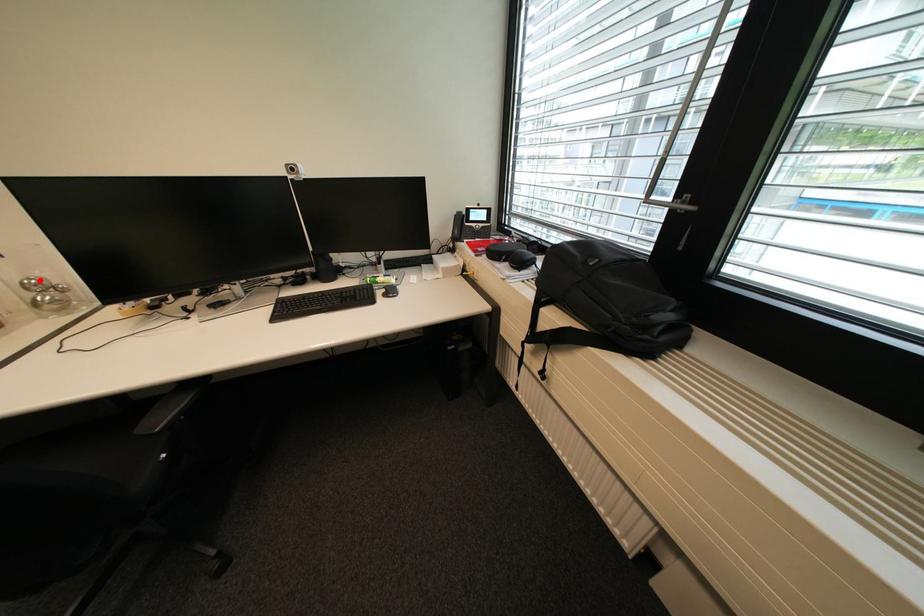
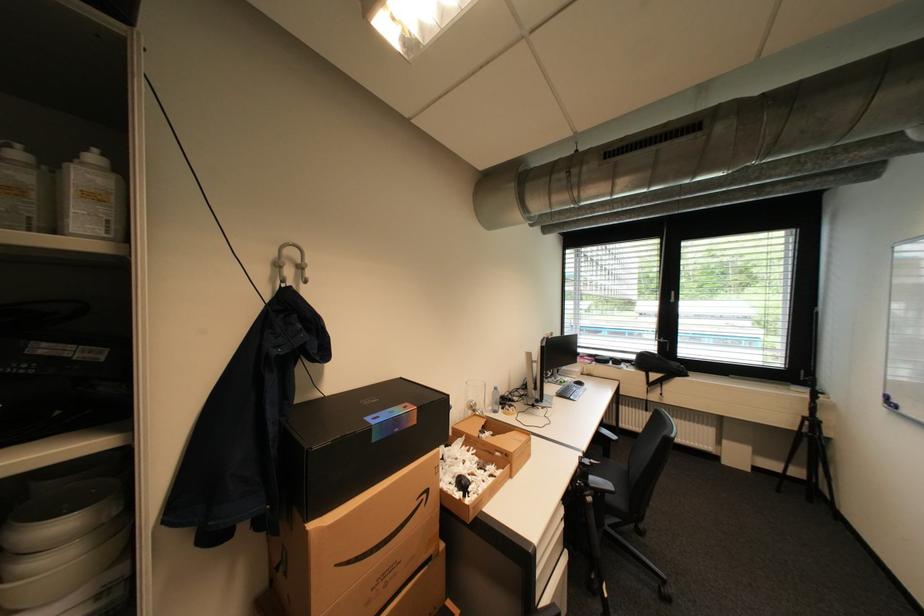
Locate, in the second image, the point that corresponds to the highlighted location in the first image.

(480, 402)